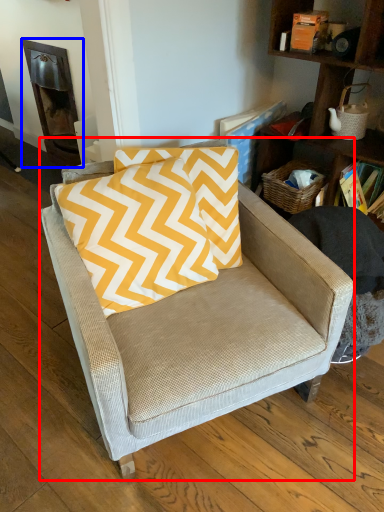
Question: Which point is closer to the camera, chair (highlighted by a red box) or fireplace (highlighted by a blue box)?

Choices:
 (A) chair
 (B) fireplace

Answer: (A)